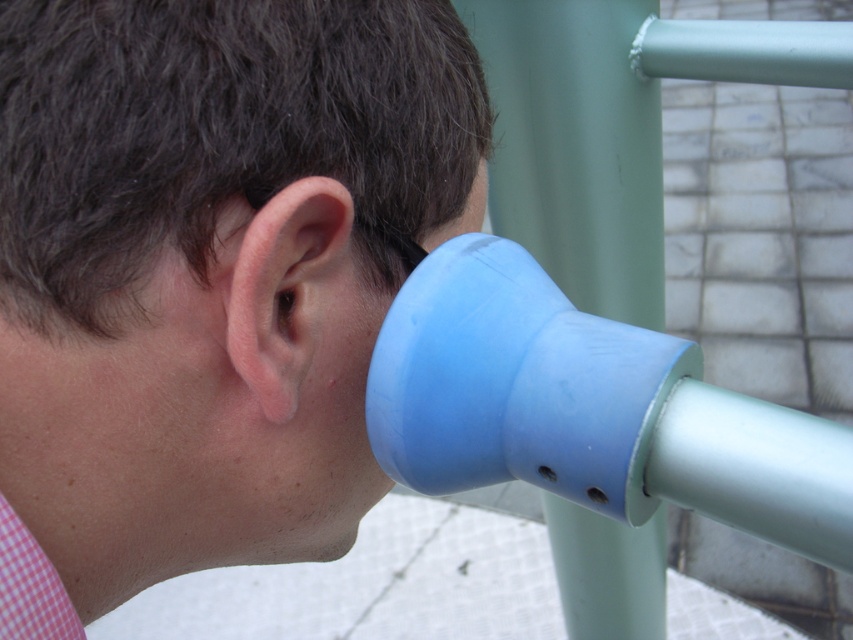
Question: Can you confirm if blue rubber cup at right is wider than pink flesh/soft tissue ear at center?

Choices:
 (A) no
 (B) yes

Answer: (B)

Question: Does blue rubber cup at right appear over pink flesh/soft tissue ear at center?

Choices:
 (A) yes
 (B) no

Answer: (B)

Question: Does blue rubber cup at right have a larger size compared to pink flesh/soft tissue ear at center?

Choices:
 (A) yes
 (B) no

Answer: (A)

Question: Which object is closer to the camera taking this photo?

Choices:
 (A) pink flesh/soft tissue ear at center
 (B) blue rubber cup at right

Answer: (B)